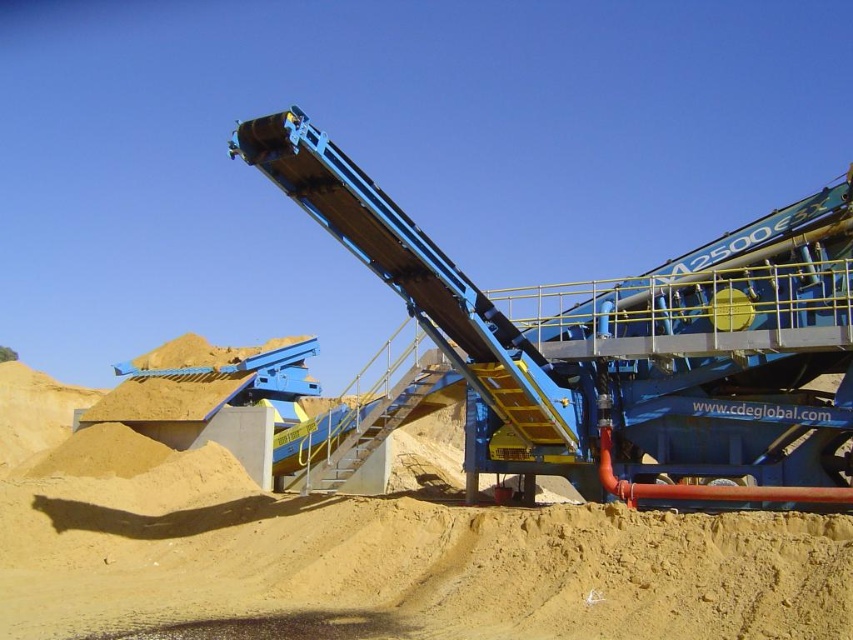
The height and width of the screenshot is (640, 853). What do you see at coordinates (403, 560) in the screenshot?
I see `yellow sand at center` at bounding box center [403, 560].

At what (x,y) coordinates should I click in order to perform the action: click on yellow sand at center. Please return your answer as a coordinate pair (x, y). Image resolution: width=853 pixels, height=640 pixels. Looking at the image, I should click on (403, 560).